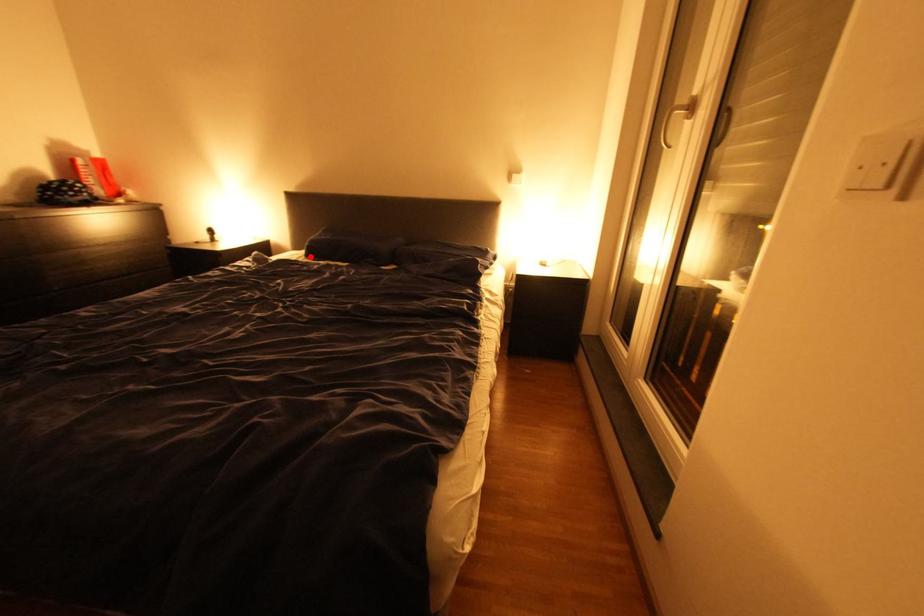
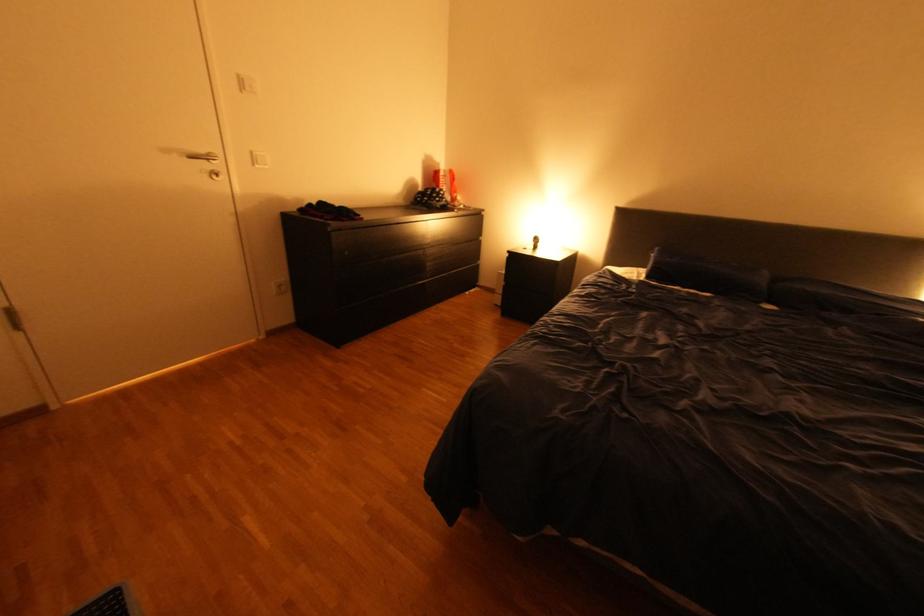
Locate, in the second image, the point that corresponds to the highlighted location in the first image.

(648, 277)